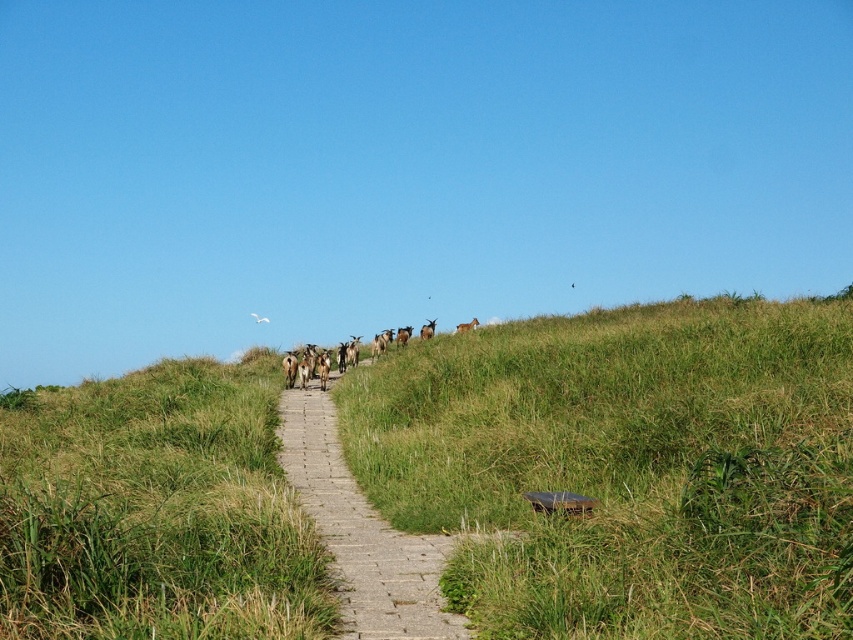
Who is positioned more to the left, green grassy hillside at center or gray concrete path at center?

Positioned to the left is gray concrete path at center.

Based on the photo, does green grassy hillside at center have a larger size compared to gray concrete path at center?

Indeed, green grassy hillside at center has a larger size compared to gray concrete path at center.

Is point (672, 589) closer to viewer compared to point (378, 589)?

Yes, point (672, 589) is closer to viewer.

You are a GUI agent. You are given a task and a screenshot of the screen. Output one action in this format:
    pyautogui.click(x=<x>, y=<y>)
    Task: Click on the green grassy hillside at center
    The width and height of the screenshot is (853, 640).
    Given the screenshot: What is the action you would take?
    pyautogui.click(x=625, y=467)

Between point (334, 456) and point (467, 323), which one is positioned in front?

Point (334, 456)

Which of these two, gray concrete path at center or brown furry goat at upper center, stands taller?

brown furry goat at upper center is taller.

Is point (419, 538) behind point (463, 324)?

That is False.

At what (x,y) coordinates should I click in order to perform the action: click on gray concrete path at center. Please return your answer as a coordinate pair (x, y). Looking at the image, I should click on (363, 532).

Measure the distance between point (488,500) and camera.

The distance of point (488,500) from camera is 80.41 feet.

The image size is (853, 640). Find the location of `green grassy hillside at center`. green grassy hillside at center is located at coordinates (625, 467).